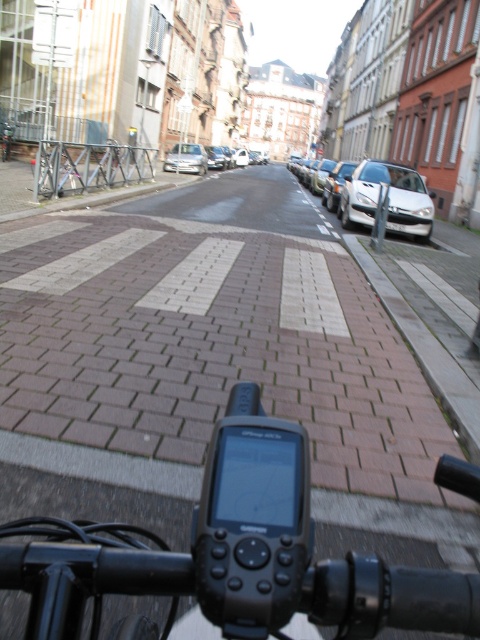
Question: Which object appears closest to the camera in this image?

Choices:
 (A) silver metallic car at center
 (B) silver metallic sedan at center
 (C) sleek silver sedan at right
 (D) brown brick pavement at center

Answer: (D)

Question: Considering the relative positions of black plastic gps device at center and metallic silver bicycle at left in the image provided, where is black plastic gps device at center located with respect to metallic silver bicycle at left?

Choices:
 (A) right
 (B) left

Answer: (A)

Question: Which point appears farthest from the camera in this image?

Choices:
 (A) (398, 365)
 (B) (424, 220)
 (C) (339, 170)
 (D) (252, 602)

Answer: (C)

Question: Can you confirm if brown brick pavement at center is wider than sleek silver sedan at right?

Choices:
 (A) yes
 (B) no

Answer: (A)

Question: Which point appears closest to the camera in this image?

Choices:
 (A) [277, 424]
 (B) [187, 172]
 (C) [331, 182]

Answer: (A)

Question: Can you confirm if brown brick pavement at center is positioned below silver metallic sedan at center?

Choices:
 (A) no
 (B) yes

Answer: (B)